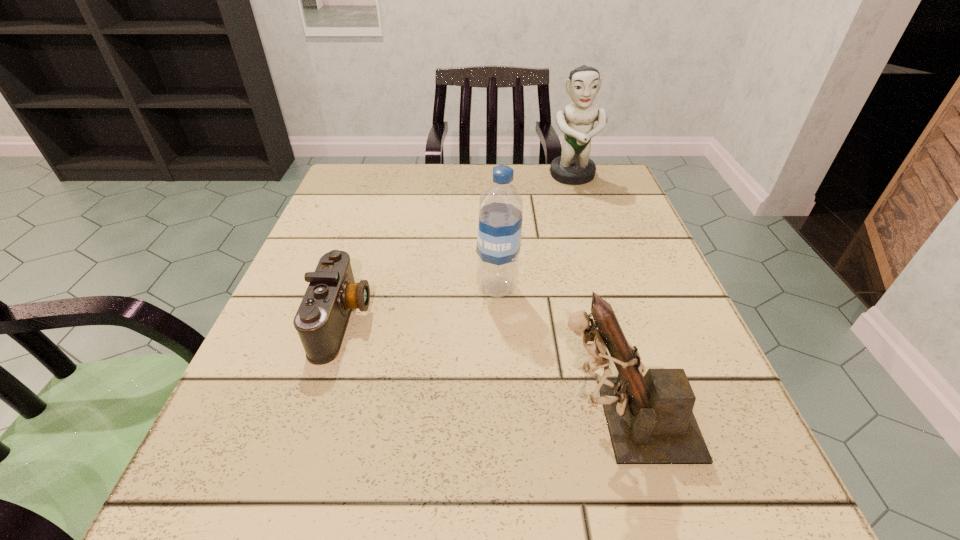
Image resolution: width=960 pixels, height=540 pixels. What are the coordinates of `vacant space positioned on the label of the water bottle` in the screenshot? It's located at (437, 288).

Locate an element on the screen. The image size is (960, 540). vacant area located 0.150m on the label of the water bottle is located at coordinates (393, 288).

At what (x,y) coordinates should I click in order to perform the action: click on vacant space situated 0.160m on the lens of the leftmost object. Please return your answer as a coordinate pair (x, y). Image resolution: width=960 pixels, height=540 pixels. Looking at the image, I should click on (466, 321).

Identify the location of object located at the far edge. (573, 167).

Where is `object that is at the near edge`? This screenshot has width=960, height=540. object that is at the near edge is located at coordinates (650, 419).

Locate an element on the screen. object that is at the left edge is located at coordinates (321, 320).

The width and height of the screenshot is (960, 540). I want to click on object located at the far right corner, so click(573, 167).

Identify the location of object that is at the near right corner. The image size is (960, 540). (650, 419).

Where is `blank area at the far edge`? blank area at the far edge is located at coordinates (536, 164).

Identify the location of free space at the near edge of the desktop. This screenshot has height=540, width=960. (518, 520).